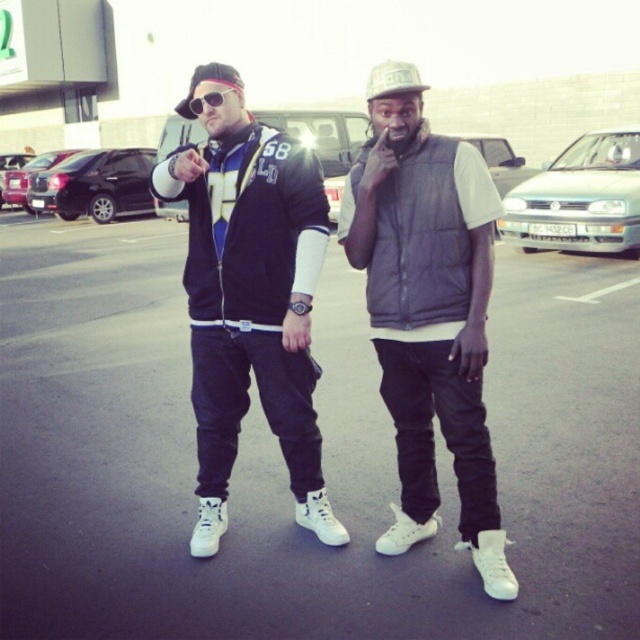
Can you confirm if matte gray vest at center is positioned below matte black jacket at center?

Indeed, matte gray vest at center is positioned under matte black jacket at center.

Consider the image. Who is positioned more to the left, matte gray vest at center or matte black jacket at center?

matte black jacket at center

Which is behind, point (429, 429) or point (220, 298)?

Point (429, 429)

At what (x,y) coordinates should I click in order to perform the action: click on matte gray vest at center. Please return your answer as a coordinate pair (x, y). The image size is (640, 640). Looking at the image, I should click on (429, 317).

Is matte black jacket at center above matte black sunglasses at center?

No, matte black jacket at center is not above matte black sunglasses at center.

Which is in front, point (205, 372) or point (220, 102)?

Point (220, 102)

Locate an element on the screen. This screenshot has width=640, height=640. matte black jacket at center is located at coordinates (250, 298).

Is matte gray vest at center further to camera compared to white fabric baseball cap at center?

Yes, it is.

Who is more forward, (416,440) or (388,61)?

Positioned in front is point (388,61).

The width and height of the screenshot is (640, 640). I want to click on matte gray vest at center, so click(x=429, y=317).

Where is `matte gray vest at center`? This screenshot has width=640, height=640. matte gray vest at center is located at coordinates (429, 317).